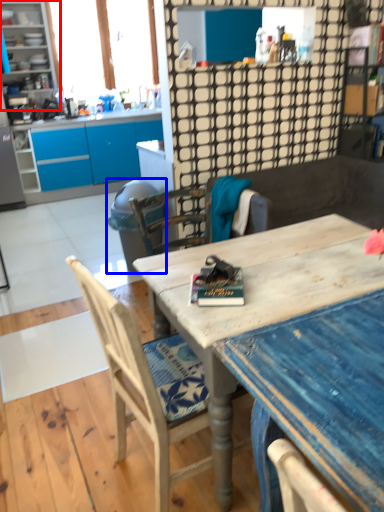
Question: Among these objects, which one is nearest to the camera, cabinetry (highlighted by a red box) or trash bin/can (highlighted by a blue box)?

Choices:
 (A) cabinetry
 (B) trash bin/can

Answer: (B)